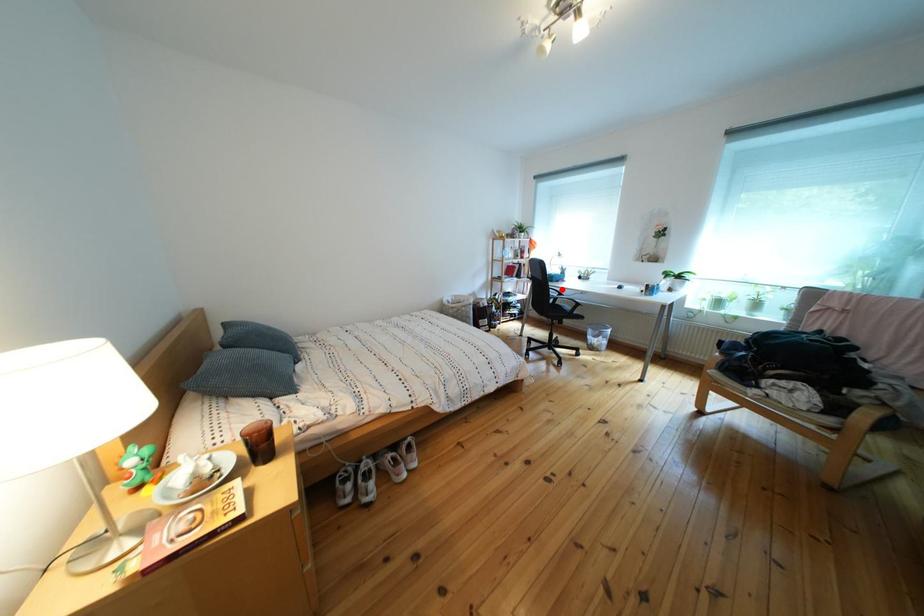
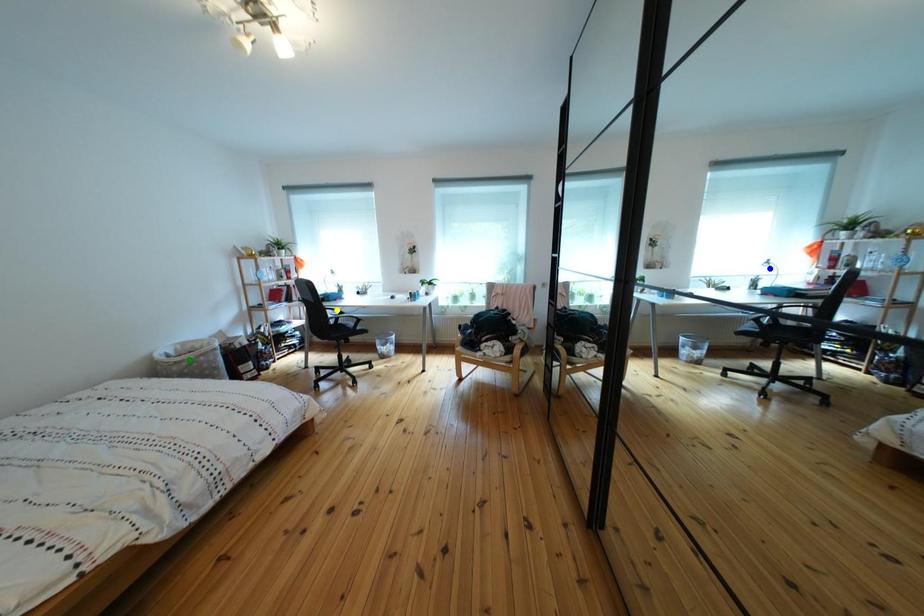
Question: I am providing you with two images of the same scene from different viewpoints. A red point is marked on the first image. You are given multiple points on the second image. Which point in image 2 represents the same 3d spot as the red point in image 1?

Choices:
 (A) green point
 (B) blue point
 (C) yellow point

Answer: (C)